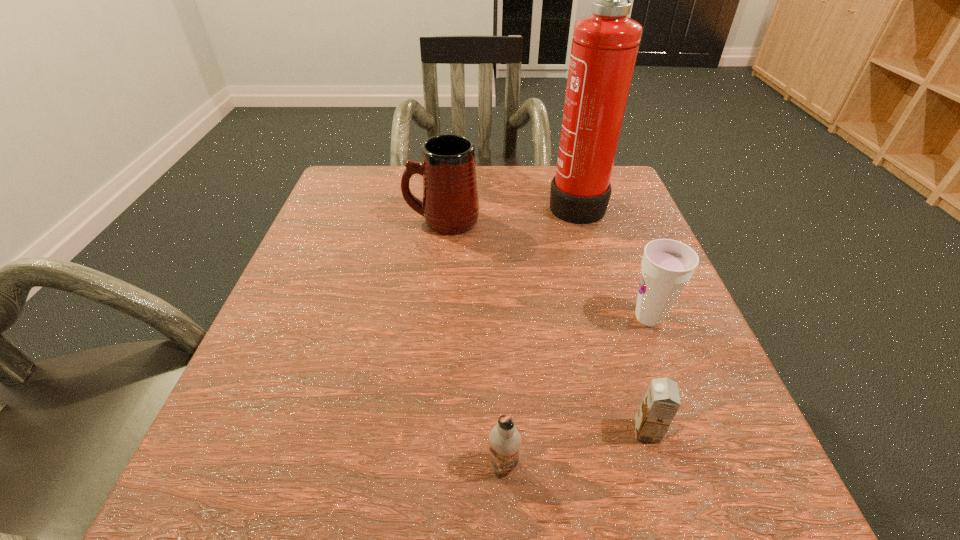
Identify the location of object that ranks as the fourth closest to the right chocolate milk. (450, 206).

Where is `the third closest object to the third farthest object`? the third closest object to the third farthest object is located at coordinates (505, 440).

The image size is (960, 540). Find the location of `vacant space that satisfies the following two spatial constraints: 1. on the side of the leftmost object with the handle; 2. on the back side of the second nearest object`. vacant space that satisfies the following two spatial constraints: 1. on the side of the leftmost object with the handle; 2. on the back side of the second nearest object is located at coordinates click(x=419, y=431).

Identify the location of blank area in the image that satisfies the following two spatial constraints: 1. on the back side of the third tallest object; 2. on the front-facing side of the fire extinguisher. (605, 202).

The height and width of the screenshot is (540, 960). In order to click on vacant region that satisfies the following two spatial constraints: 1. on the front-facing side of the fire extinguisher; 2. on the left side of the cup in this screenshot , I will do `click(610, 318)`.

Identify the location of free spot that satisfies the following two spatial constraints: 1. on the front-facing side of the tallest object; 2. on the left side of the farther chocolate milk. (643, 431).

The width and height of the screenshot is (960, 540). I want to click on free region that satisfies the following two spatial constraints: 1. on the front-facing side of the farther chocolate milk; 2. on the right side of the tallest object, so click(x=643, y=431).

Identify the location of free space that satisfies the following two spatial constraints: 1. on the back side of the left chocolate milk; 2. on the left side of the second nearest object. The height and width of the screenshot is (540, 960). (502, 431).

The width and height of the screenshot is (960, 540). Identify the location of vacant region that satisfies the following two spatial constraints: 1. on the front-facing side of the fire extinguisher; 2. on the right side of the right chocolate milk. (643, 431).

Image resolution: width=960 pixels, height=540 pixels. I want to click on vacant point that satisfies the following two spatial constraints: 1. on the side of the nearer chocolate milk with the handle; 2. on the right side of the fourth shortest object, so click(416, 464).